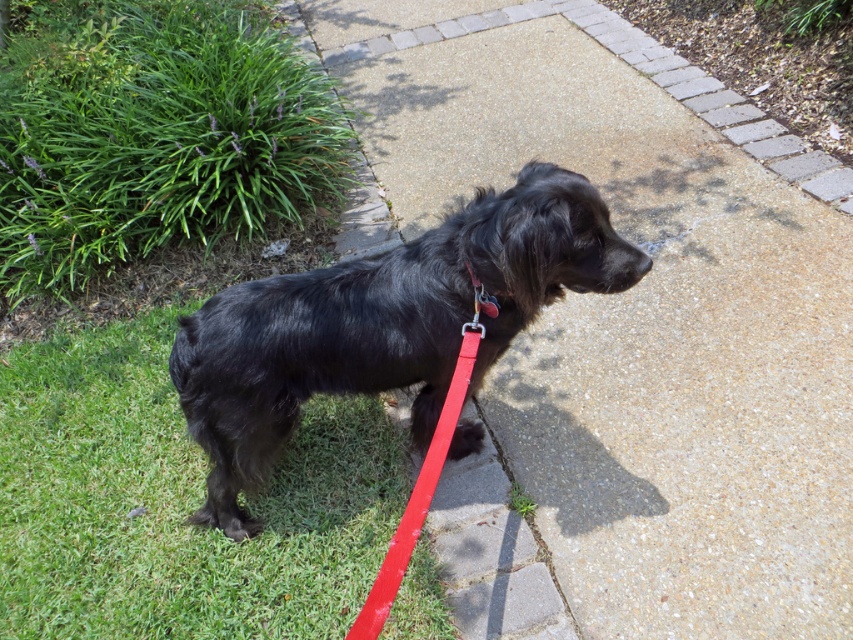
Question: Does black shaggy dog at center come behind red leather collar at center?

Choices:
 (A) no
 (B) yes

Answer: (A)

Question: Which point is closer to the camera?

Choices:
 (A) black shaggy dog at center
 (B) red rubber leash at lower center
 (C) smooth concrete pavement at center

Answer: (B)

Question: In this image, where is green leafy grass at upper left located relative to red rubber leash at lower center?

Choices:
 (A) below
 (B) above

Answer: (B)

Question: Which object is positioned farthest from the red leather collar at center?

Choices:
 (A) green grass at lower left
 (B) smooth concrete pavement at center
 (C) green leafy grass at upper left
 (D) black shaggy dog at center

Answer: (C)

Question: Which point is closer to the camera?

Choices:
 (A) (656, 580)
 (B) (422, 500)

Answer: (B)

Question: Can you confirm if green grass at lower left is positioned to the left of green leafy grass at upper left?

Choices:
 (A) yes
 (B) no

Answer: (B)